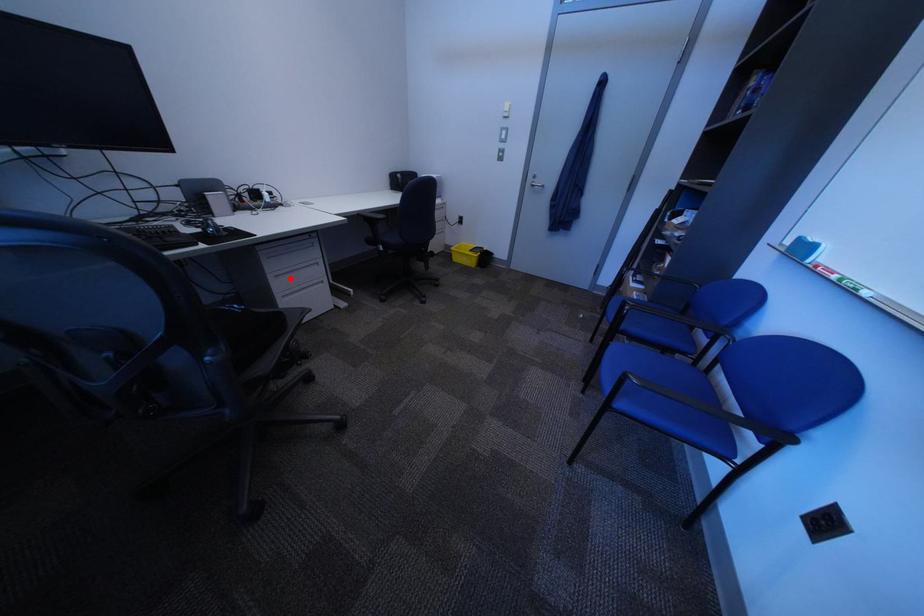
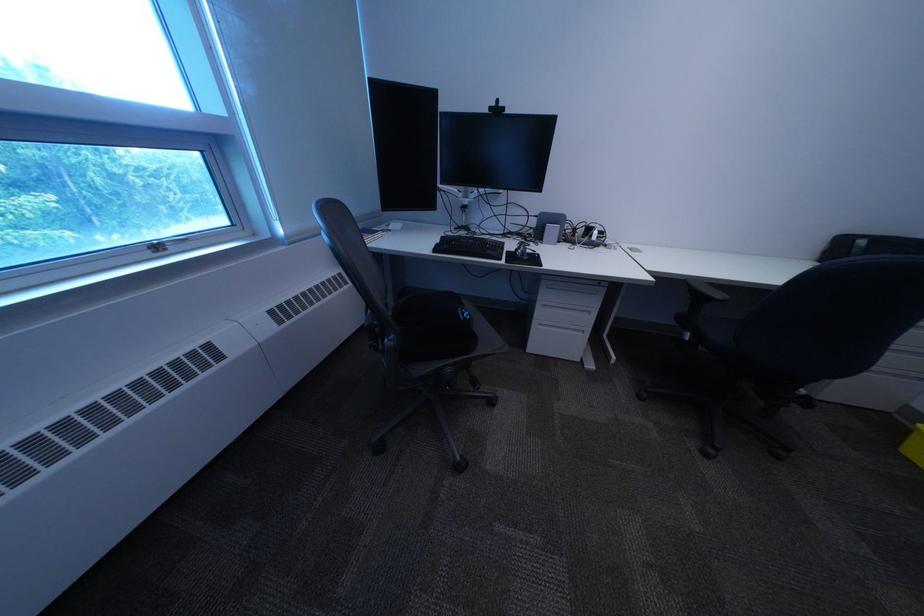
Question: I am providing you with two images of the same scene from different viewpoints. A red point is marked on the first image. Is the red point's position out of view in image 2?

Choices:
 (A) Yes
 (B) No

Answer: (B)